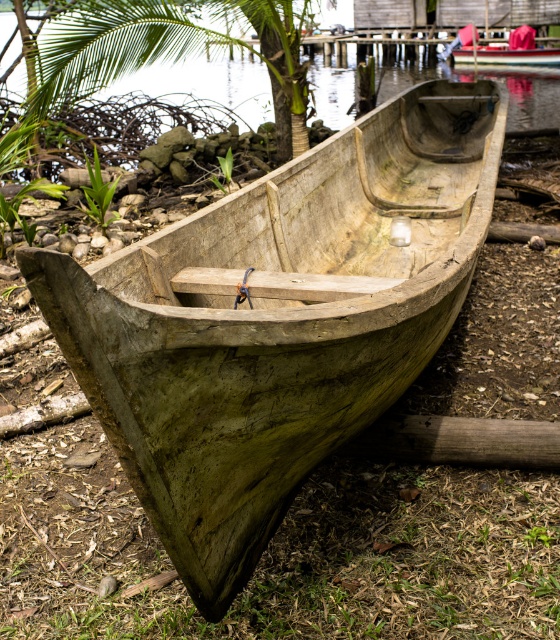
Who is more forward, (301, 4) or (554, 48)?

Point (301, 4) is more forward.

Find the location of `green leafy tree at upper left`. green leafy tree at upper left is located at coordinates (174, 51).